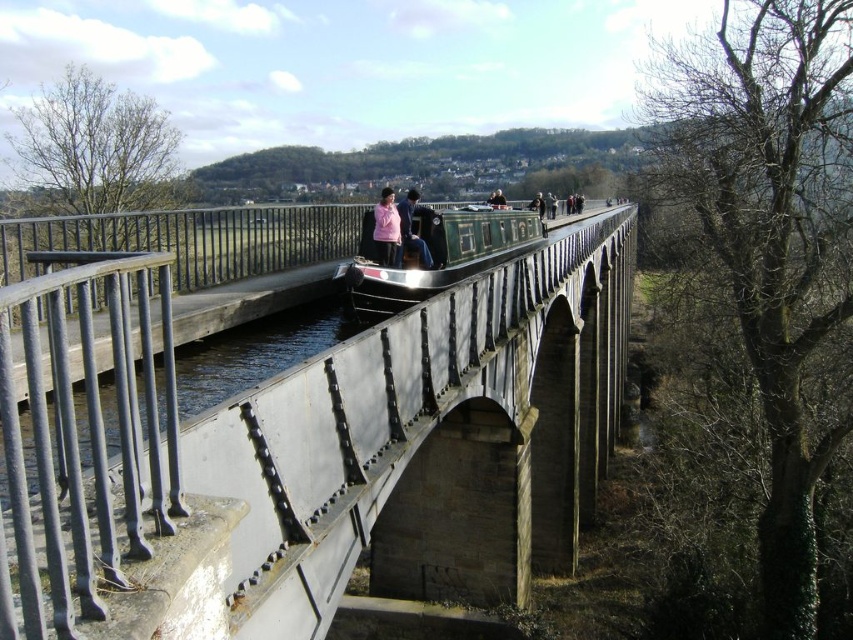
Between smooth metal railing at left and pink fabric jacket at center, which one is positioned lower?

smooth metal railing at left

Can you confirm if smooth metal railing at left is smaller than pink fabric jacket at center?

Correct, smooth metal railing at left occupies less space than pink fabric jacket at center.

Does point (22, 595) lie behind point (381, 228)?

No, it is in front of (381, 228).

This screenshot has height=640, width=853. Identify the location of smooth metal railing at left. (78, 436).

Is green polished wood boat at center to the right of pink fabric jacket at center from the viewer's perspective?

Indeed, green polished wood boat at center is positioned on the right side of pink fabric jacket at center.

Between green polished wood boat at center and pink fabric jacket at center, which one appears on the right side from the viewer's perspective?

green polished wood boat at center

Locate an element on the screen. green polished wood boat at center is located at coordinates (434, 256).

Can you confirm if pink fabric jacket at center is taller than matte pink jacket at center?

In fact, pink fabric jacket at center may be shorter than matte pink jacket at center.

Where is `pink fabric jacket at center`? This screenshot has height=640, width=853. pink fabric jacket at center is located at coordinates (386, 228).